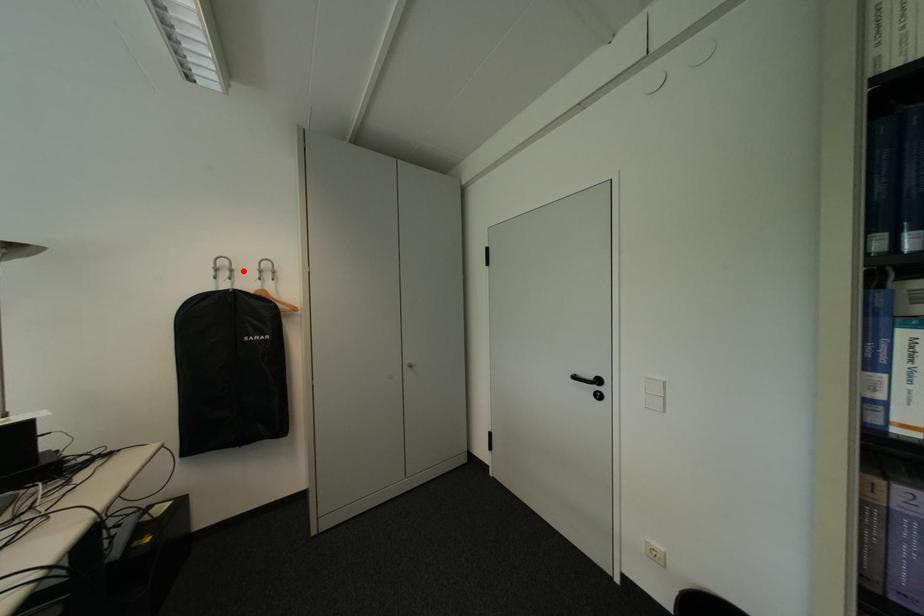
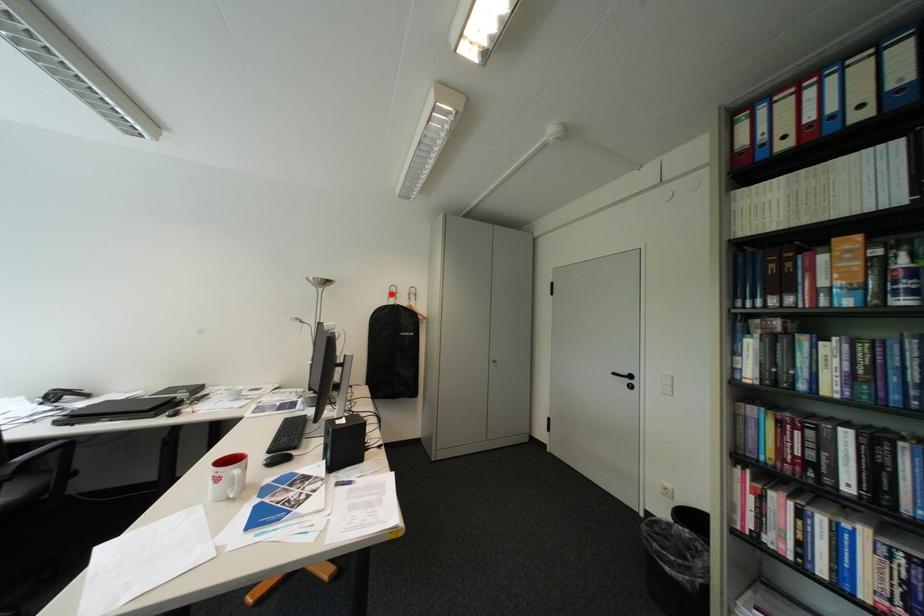
I am providing you with two images of the same scene from different viewpoints. A red point is marked on the first image and another point is marked on the second image. Is the marked point in image1 the same physical position as the marked point in image2?

No